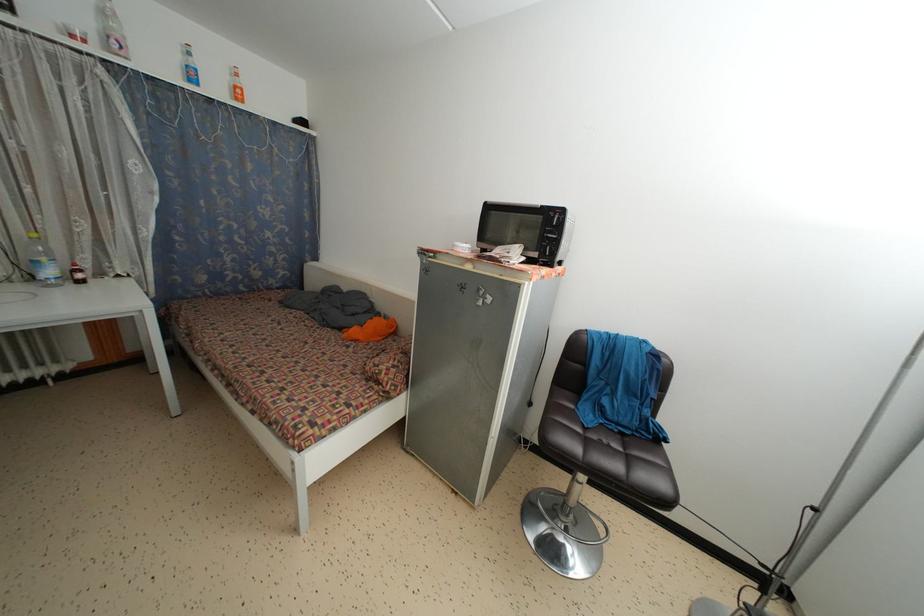
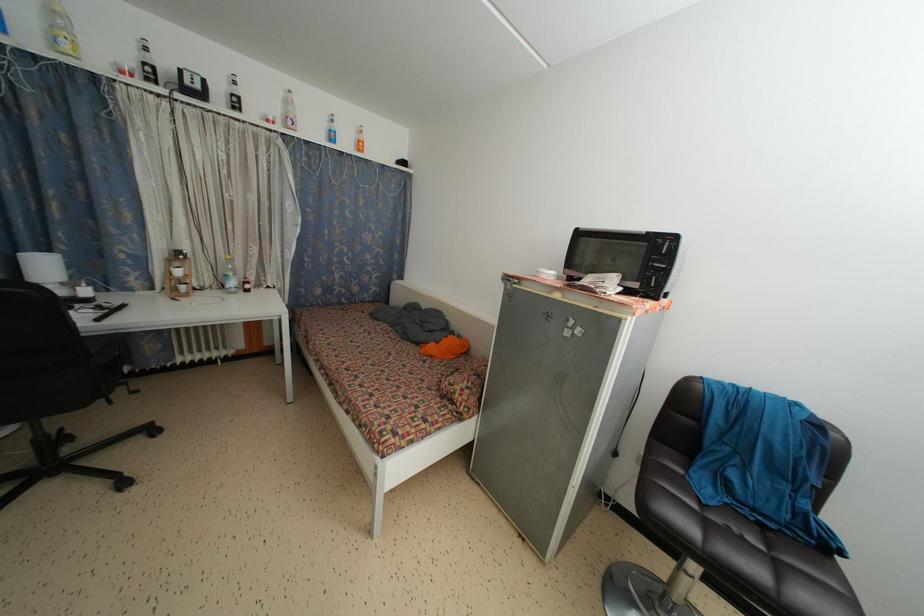
Find the pixel in the second image that matches [55,278] in the first image.

(237, 289)